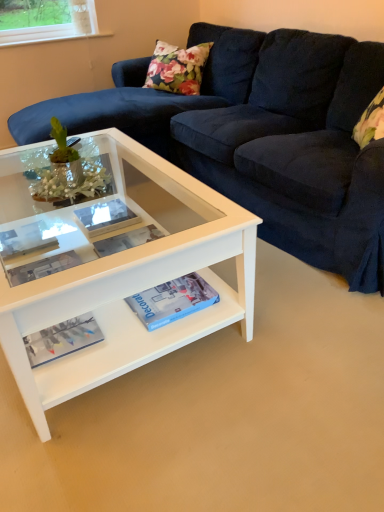
Question: Can you confirm if matte white book at center is taller than matte white paperback book at center, which is counted as the first paperback book, starting from the back?

Choices:
 (A) yes
 (B) no

Answer: (B)

Question: From the image's perspective, does matte white book at center appear higher than matte white paperback book at center, placed as the second paperback book when sorted from right to left?

Choices:
 (A) yes
 (B) no

Answer: (B)

Question: Can we say matte white book at center lies outside matte white paperback book at center, which is counted as the second paperback book, starting from the bottom?

Choices:
 (A) no
 (B) yes

Answer: (B)

Question: Considering the relative sizes of matte white book at center and matte white paperback book at center, which is counted as the first paperback book, starting from the left, in the image provided, is matte white book at center thinner than matte white paperback book at center, which is counted as the first paperback book, starting from the left,?

Choices:
 (A) yes
 (B) no

Answer: (A)

Question: Is matte white book at center aimed at matte white paperback book at center, which is counted as the second paperback book, starting from the bottom?

Choices:
 (A) yes
 (B) no

Answer: (B)

Question: Looking at their shapes, would you say matte blue magazine at lower left is wider or thinner than velvet dark blue couch at center?

Choices:
 (A) wide
 (B) thin

Answer: (B)

Question: From their relative heights in the image, would you say matte blue magazine at lower left is taller or shorter than velvet dark blue couch at center?

Choices:
 (A) short
 (B) tall

Answer: (A)

Question: Is matte blue magazine at lower left bigger or smaller than velvet dark blue couch at center?

Choices:
 (A) big
 (B) small

Answer: (B)

Question: Considering their positions, is matte blue magazine at lower left located in front of or behind velvet dark blue couch at center?

Choices:
 (A) front
 (B) behind

Answer: (B)

Question: Is matte white paperback book at center, which is counted as the second paperback book, starting from the bottom, bigger or smaller than matte white book at center?

Choices:
 (A) big
 (B) small

Answer: (A)

Question: From a real-world perspective, relative to matte white book at center, is matte white paperback book at center, which is counted as the first paperback book, starting from the left, vertically above or below?

Choices:
 (A) above
 (B) below

Answer: (A)

Question: In the image, is matte white paperback book at center, the first paperback book in the top-to-bottom sequence, on the left side or the right side of matte white book at center?

Choices:
 (A) right
 (B) left

Answer: (A)

Question: Choose the correct answer: Is matte white paperback book at center, placed as the 2th paperback book when sorted from front to back, inside matte white book at center or outside it?

Choices:
 (A) inside
 (B) outside

Answer: (B)

Question: Considering the positions of matte blue magazine at lower left and matte white paperback book at center, placed as the 2th paperback book when sorted from front to back, in the image, is matte blue magazine at lower left bigger or smaller than matte white paperback book at center, placed as the 2th paperback book when sorted from front to back,?

Choices:
 (A) small
 (B) big

Answer: (A)

Question: Choose the correct answer: Is matte blue magazine at lower left inside matte white paperback book at center, placed as the second paperback book when sorted from right to left, or outside it?

Choices:
 (A) outside
 (B) inside

Answer: (A)